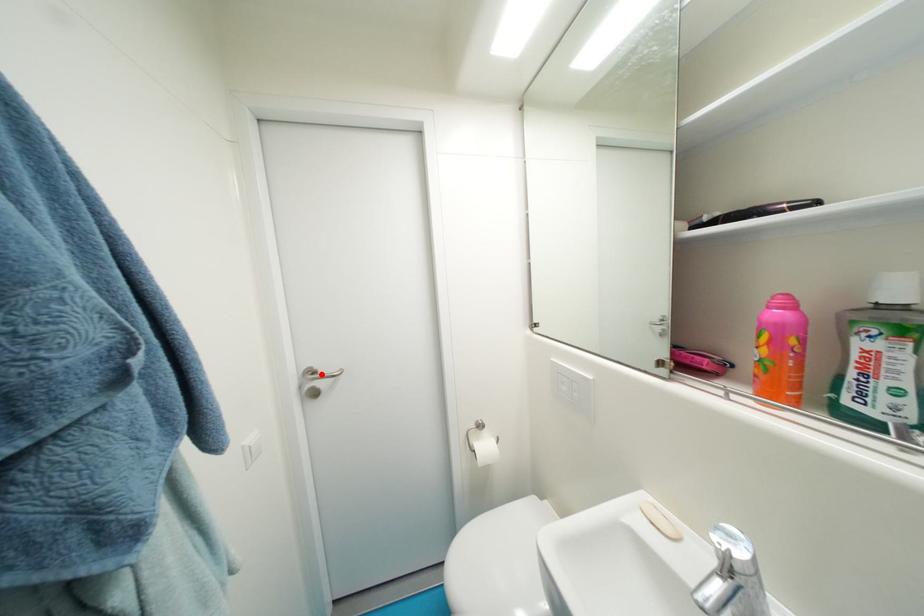
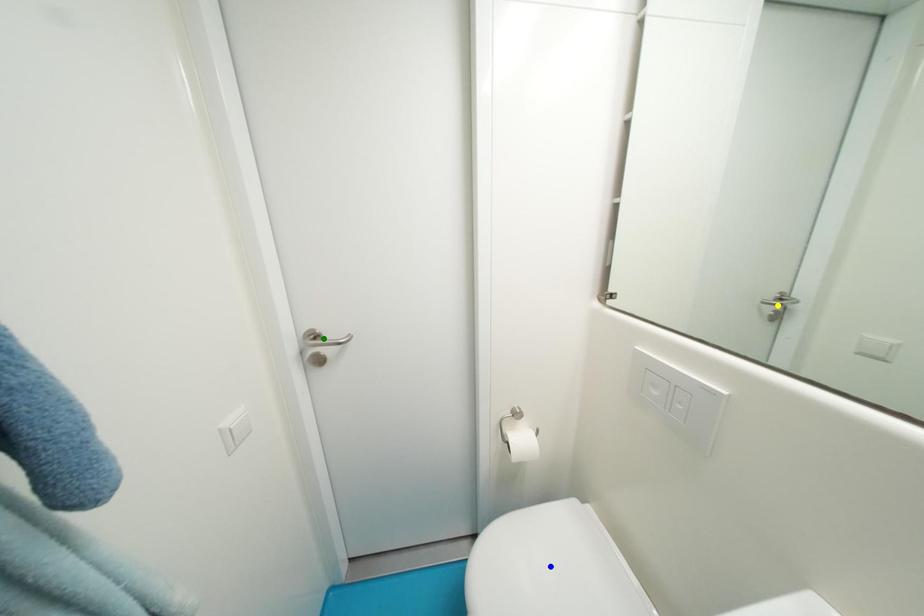
Question: I am providing you with two images of the same scene from different viewpoints. A red point is marked on the first image. You are given multiple points on the second image. Which point in image 2 is actually the same real-world point as the red point in image 1?

Choices:
 (A) blue point
 (B) green point
 (C) yellow point

Answer: (B)